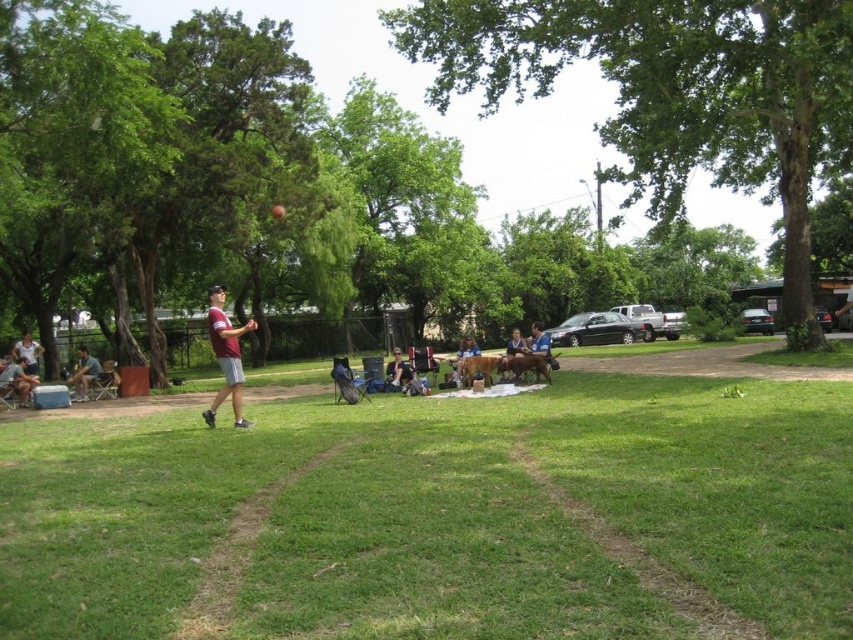
You are standing in the park and see the green grass at center and the maroon jersey at center. Which object is located to the right side?

The green grass at center is to the right of maroon jersey at center.

You are a photographer trying to capture the exact location of the matte gray shorts at center in the park scene. According to the coordinates provided, where would you position your camera to ensure the shorts are centered in the frame?

The matte gray shorts at center are located at coordinates point (399, 371), so positioning the camera to center the frame at those coordinates would ensure the shorts are centered.